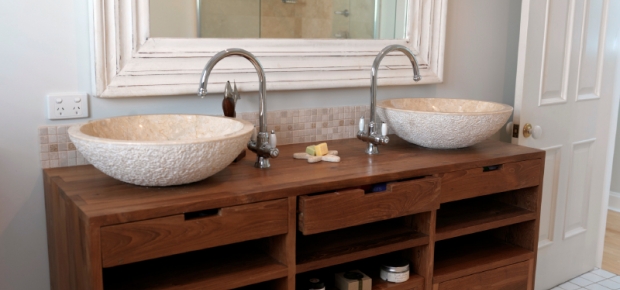
What are the coordinates of `silver gray cylinder shaped handles` in the screenshot? It's located at (382, 126), (360, 125).